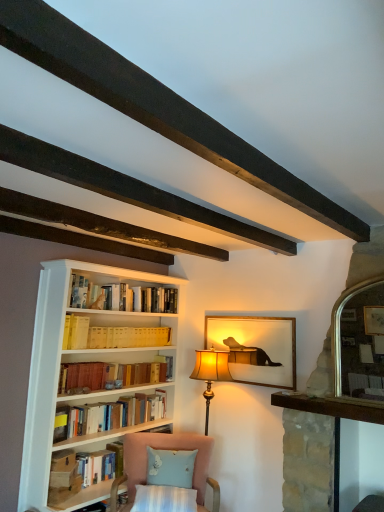
Question: Looking at the image, does hardcover book at lower left, placed as the first book when sorted from bottom to top, seem bigger or smaller compared to yellow cardboard book at center, positioned as the first book in top-to-bottom order?

Choices:
 (A) small
 (B) big

Answer: (A)

Question: In terms of height, does hardcover book at lower left, the third book positioned from the top, look taller or shorter compared to yellow cardboard book at center, positioned as the first book in top-to-bottom order?

Choices:
 (A) tall
 (B) short

Answer: (A)

Question: Estimate the real-world distances between objects in this image. Which object is closer to the matte gold picture frame at center?

Choices:
 (A) hardcover book at lower left, the third book positioned from the top
 (B) light blue fabric pillow at lower center
 (C) yellow cardboard book at center, positioned as the first book in top-to-bottom order
 (D) dark wood beam at upper center
 (E) hardcover books at center, placed as the 2th book when sorted from top to bottom

Answer: (C)

Question: Which of these objects is positioned farthest from the matte gold picture frame at center?

Choices:
 (A) yellow cardboard book at center, which is the 3th book from bottom to top
 (B) hardcover book at lower left, the third book positioned from the top
 (C) dark wood beam at upper center
 (D) hardcover books at center, the 2th book positioned from the bottom
 (E) pink fabric chair at lower center

Answer: (C)